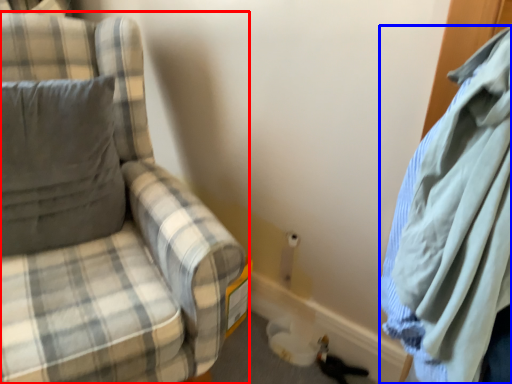
Question: Among these objects, which one is nearest to the camera, chair (highlighted by a red box) or cloak (highlighted by a blue box)?

Choices:
 (A) chair
 (B) cloak

Answer: (B)